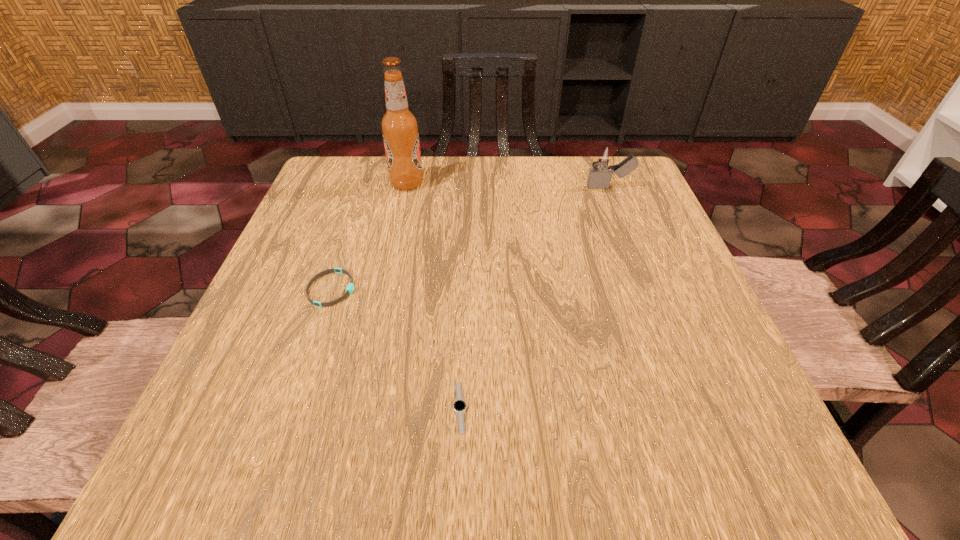
You are a GUI agent. You are given a task and a screenshot of the screen. Output one action in this format:
    pyautogui.click(x=<x>, y=<y>)
    Task: Click on the vacant area that lies between the igniter and the second object from left to right
    This screenshot has width=960, height=540.
    Given the screenshot: What is the action you would take?
    pyautogui.click(x=508, y=185)

Find the location of `free space between the leftmost object and the tallest object`. free space between the leftmost object and the tallest object is located at coordinates (370, 237).

Locate an element on the screen. The width and height of the screenshot is (960, 540). free spot between the rightmost object and the beer bottle is located at coordinates (508, 185).

The width and height of the screenshot is (960, 540). Find the location of `vacant space that's between the igniter and the third object from right to left`. vacant space that's between the igniter and the third object from right to left is located at coordinates (508, 185).

Locate an element on the screen. empty space between the rightmost object and the nearest object is located at coordinates (535, 297).

Identify which object is the second nearest to the third tallest object. Please provide its 2D coordinates. Your answer should be formatted as a tuple, i.e. [(x, y)], where the tuple contains the x and y coordinates of a point satisfying the conditions above.

[(399, 126)]

The width and height of the screenshot is (960, 540). I want to click on object identified as the third closest to the rightmost object, so click(459, 406).

Image resolution: width=960 pixels, height=540 pixels. Identify the location of free space that satisfies the following two spatial constraints: 1. on the back side of the watch; 2. on the front label of the second object from left to right. (468, 184).

What are the coordinates of `vacant space that satisfies the following two spatial constraints: 1. on the front label of the tallest object; 2. on the back side of the igniter` in the screenshot? It's located at (406, 187).

Where is `vacant position in the image that satisfies the following two spatial constraints: 1. on the front label of the tallest object; 2. on the right side of the second object from right to left`? vacant position in the image that satisfies the following two spatial constraints: 1. on the front label of the tallest object; 2. on the right side of the second object from right to left is located at coordinates (358, 407).